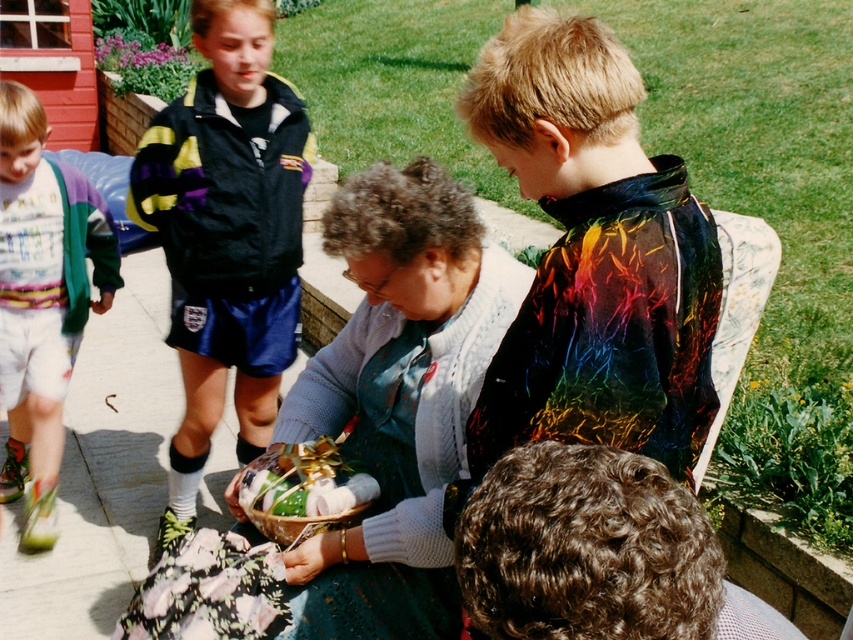
Question: Among these points, which one is farthest from the camera?

Choices:
 (A) (585, 352)
 (B) (323, 364)

Answer: (B)

Question: Which point is closer to the camera?

Choices:
 (A) tap(276, 492)
 (B) tap(292, 202)
 (C) tap(30, 486)
 (D) tap(670, 225)

Answer: (D)

Question: Where is knitted sweater at center located in relation to shiny metallic bowl at center in the image?

Choices:
 (A) left
 (B) right

Answer: (B)

Question: Is rainbow reflective jacket at center closer to the viewer compared to shiny metallic bowl at center?

Choices:
 (A) no
 (B) yes

Answer: (B)

Question: Which object is positioned farthest from the knitted sweater at center?

Choices:
 (A) multicolored fleece jacket at left
 (B) black jacket at upper left
 (C) shiny metallic bowl at center

Answer: (A)

Question: Is black jacket at upper left to the right of multicolored fleece jacket at left from the viewer's perspective?

Choices:
 (A) no
 (B) yes

Answer: (B)